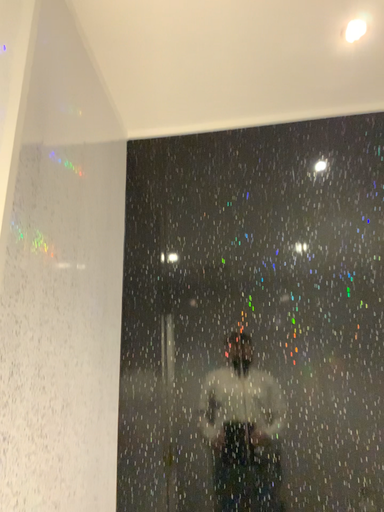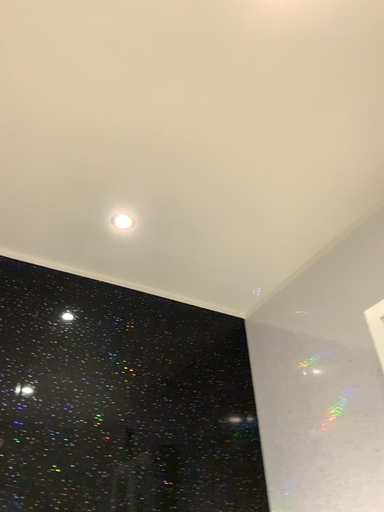
Question: How did the camera likely rotate when shooting the video?

Choices:
 (A) rotated downward
 (B) rotated upward

Answer: (B)